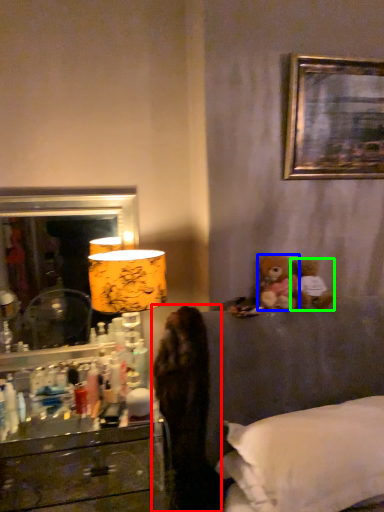
Question: Which object is positioned closest to dark (highlighted by a red box)? Select from teddy bear (highlighted by a blue box) and teddy bear (highlighted by a green box).

Choices:
 (A) teddy bear
 (B) teddy bear

Answer: (A)